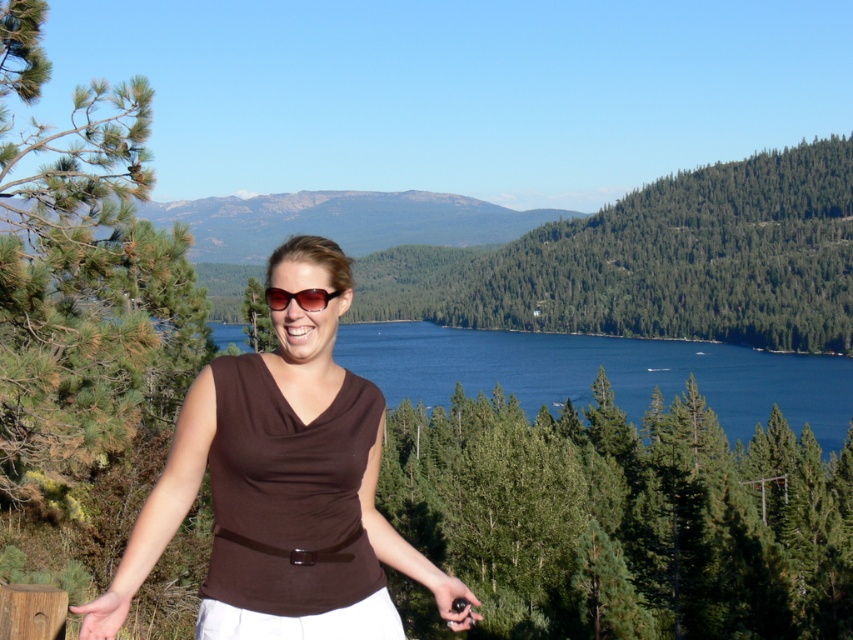
You are a photographer trying to capture the entire scene in one shot. You notice the rocky gray mountain at upper center and the brown matte sunglasses at center. Which object should you focus on first if you want to ensure both are in frame?

The rocky gray mountain at upper center is much taller than the brown matte sunglasses at center, so you should focus on the rocky gray mountain at upper center first to ensure both are in frame.

You are a photographer trying to capture the woman in the brown fabric shirt at center and the rocky gray mountain at upper center in the same frame. Based on their positions, which object is closer to the camera?

The brown fabric shirt at center is closer to the camera because it is located below the rocky gray mountain at upper center, indicating that the mountain is in the background while the shirt is in the foreground.

You are a hiker who wants to take a photo of the brown fabric shirt at center and the rocky gray mountain at upper center in the same frame. Given that your camera has a maximum zoom range of 100 meters, can you capture both objects in one shot without moving your position?

The distance between the brown fabric shirt at center and the rocky gray mountain at upper center is 458.76 meters. Since your camera can only zoom up to 100 meters, it is not possible to capture both objects in the same frame without moving your position.